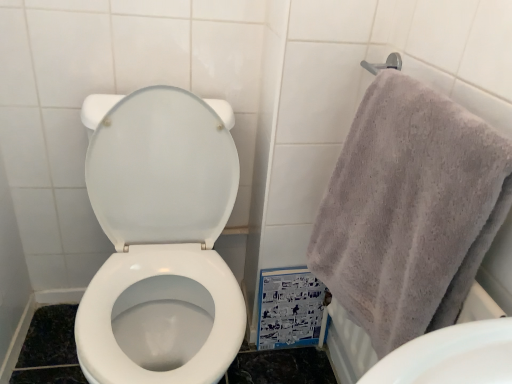
Question: Does point (435, 208) appear closer or farther from the camera than point (105, 147)?

Choices:
 (A) closer
 (B) farther

Answer: (A)

Question: Is gray cotton towel at upper right taller or shorter than white glossy toilet at center?

Choices:
 (A) short
 (B) tall

Answer: (A)

Question: From a real-world perspective, relative to white glossy toilet at center, is gray cotton towel at upper right vertically above or below?

Choices:
 (A) above
 (B) below

Answer: (A)

Question: Is point (163, 193) closer or farther from the camera than point (424, 198)?

Choices:
 (A) closer
 (B) farther

Answer: (B)

Question: In the image, is white glossy toilet at center on the left side or the right side of gray cotton towel at upper right?

Choices:
 (A) right
 (B) left

Answer: (B)

Question: Is white glossy toilet at center inside or outside of gray cotton towel at upper right?

Choices:
 (A) outside
 (B) inside

Answer: (A)

Question: Considering their positions, is white glossy toilet at center located in front of or behind gray cotton towel at upper right?

Choices:
 (A) behind
 (B) front

Answer: (A)